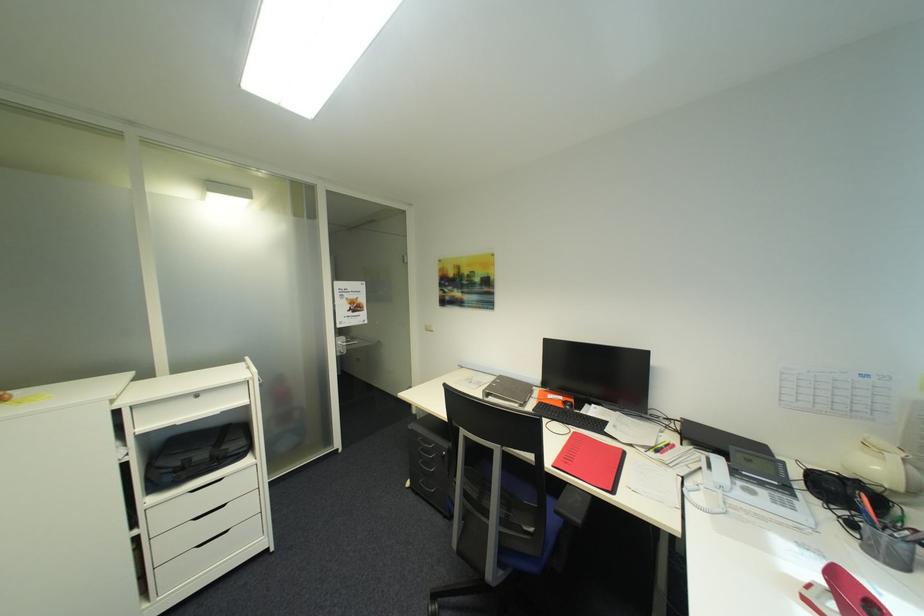
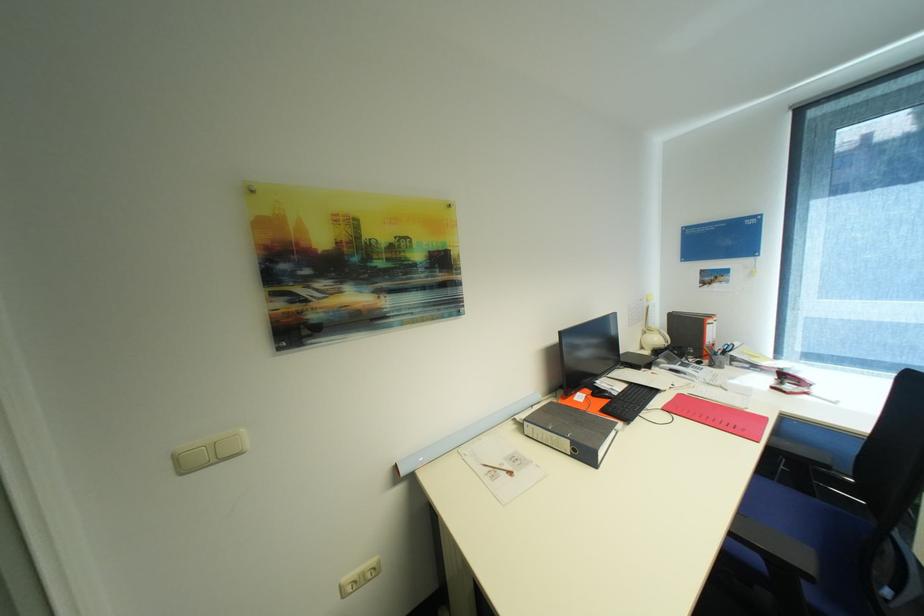
In the second image, find the point that corresponds to (433,326) in the first image.

(185, 458)